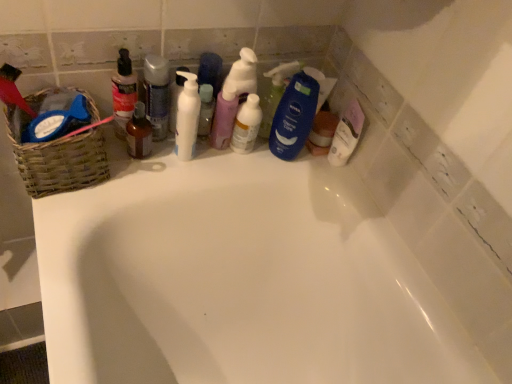
Question: In which direction should I rotate to look at translucent plastic spray bottle at center, which appears as the 4th cleaning product when viewed from the right?

Choices:
 (A) left
 (B) right

Answer: (A)

Question: Is brown glass bottle at center thinner than woven brown basket at left?

Choices:
 (A) no
 (B) yes

Answer: (B)

Question: Considering the relative sizes of brown glass bottle at center and woven brown basket at left in the image provided, is brown glass bottle at center wider than woven brown basket at left?

Choices:
 (A) no
 (B) yes

Answer: (A)

Question: Is brown glass bottle at center oriented away from woven brown basket at left?

Choices:
 (A) yes
 (B) no

Answer: (B)

Question: Considering the relative positions of brown glass bottle at center and woven brown basket at left in the image provided, is brown glass bottle at center behind woven brown basket at left?

Choices:
 (A) yes
 (B) no

Answer: (A)

Question: Can you confirm if brown glass bottle at center is bigger than woven brown basket at left?

Choices:
 (A) yes
 (B) no

Answer: (B)

Question: Is brown glass bottle at center next to woven brown basket at left?

Choices:
 (A) no
 (B) yes

Answer: (A)

Question: From a real-world perspective, is translucent plastic bottle at upper left located higher than brown glass bottle at center?

Choices:
 (A) no
 (B) yes

Answer: (B)

Question: Is translucent plastic bottle at upper left positioned in front of brown glass bottle at center?

Choices:
 (A) no
 (B) yes

Answer: (B)

Question: Can you confirm if translucent plastic bottle at upper left is shorter than brown glass bottle at center?

Choices:
 (A) no
 (B) yes

Answer: (A)

Question: From a real-world perspective, is translucent plastic bottle at upper left positioned under brown glass bottle at center based on gravity?

Choices:
 (A) yes
 (B) no

Answer: (B)

Question: Does translucent plastic bottle at upper left have a smaller size compared to brown glass bottle at center?

Choices:
 (A) no
 (B) yes

Answer: (A)

Question: Is translucent plastic bottle at upper left to the left of brown glass bottle at center from the viewer's perspective?

Choices:
 (A) yes
 (B) no

Answer: (A)

Question: Can you confirm if pastel pink pump bottle at center, which ranks as the 2th cleaning product in left-to-right order, is taller than translucent plastic spray bottle at center, which is counted as the third cleaning product, starting from the left?

Choices:
 (A) no
 (B) yes

Answer: (B)